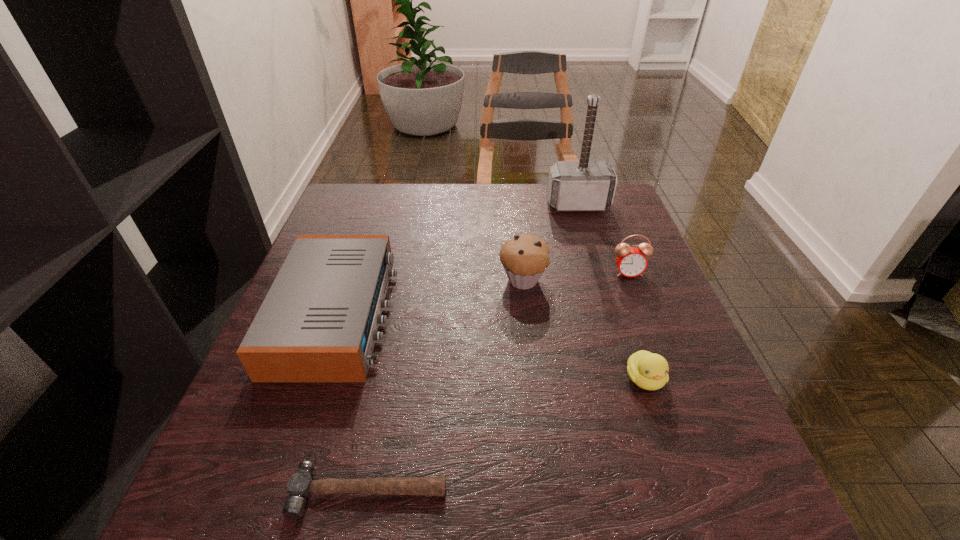
Find the location of a particular element. free spot between the fourth object from right to left and the right hammer is located at coordinates (550, 242).

You are a GUI agent. You are given a task and a screenshot of the screen. Output one action in this format:
    pyautogui.click(x=<x>, y=<y>)
    Task: Click on the free space between the radio receiver and the shorter hammer
    
    Given the screenshot: What is the action you would take?
    pyautogui.click(x=353, y=403)

Locate an element on the screen. free space between the nearer hammer and the tallest object is located at coordinates (473, 348).

What are the coordinates of `blank region between the duckling and the left hammer` in the screenshot? It's located at (507, 435).

Identify the location of vacant point located between the muffin and the duckling. (584, 329).

In order to click on free space that is in between the alarm clock and the right hammer in this screenshot , I will do `click(603, 239)`.

The width and height of the screenshot is (960, 540). I want to click on vacant area that lies between the radio receiver and the alarm clock, so click(482, 294).

Where is `blank region between the right hammer and the alarm clock`? This screenshot has width=960, height=540. blank region between the right hammer and the alarm clock is located at coordinates (603, 239).

Image resolution: width=960 pixels, height=540 pixels. What are the coordinates of `object that is the closest to the third object from left to right` in the screenshot? It's located at (631, 261).

Where is `the fifth closest object to the alarm clock`? Image resolution: width=960 pixels, height=540 pixels. the fifth closest object to the alarm clock is located at coordinates (300, 486).